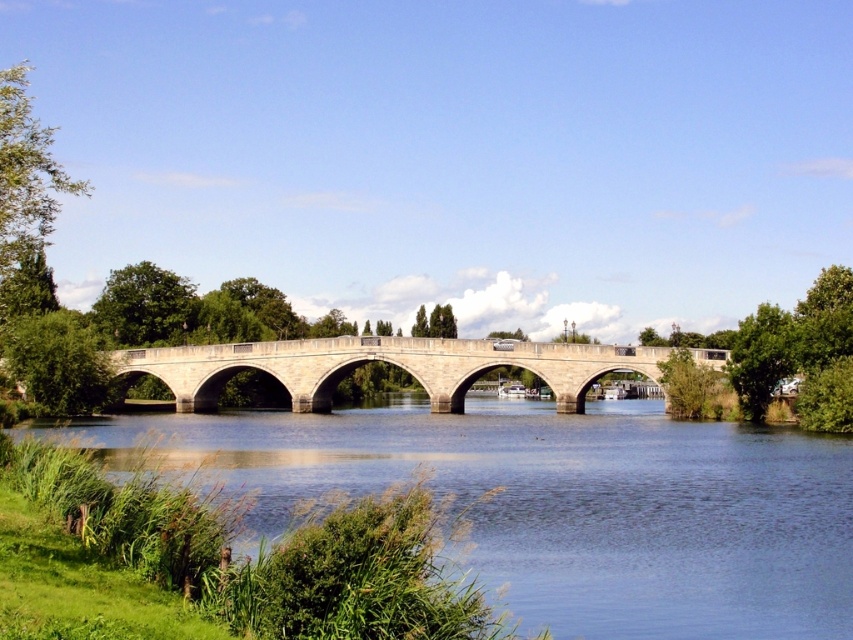
You are standing at the point with coordinates (561, 502) in the image. Based on the scene description, what object are you most likely standing on?

The point at coordinates (561, 502) corresponds to the blue stone bridge at center, so you are most likely standing on the blue stone bridge at center.